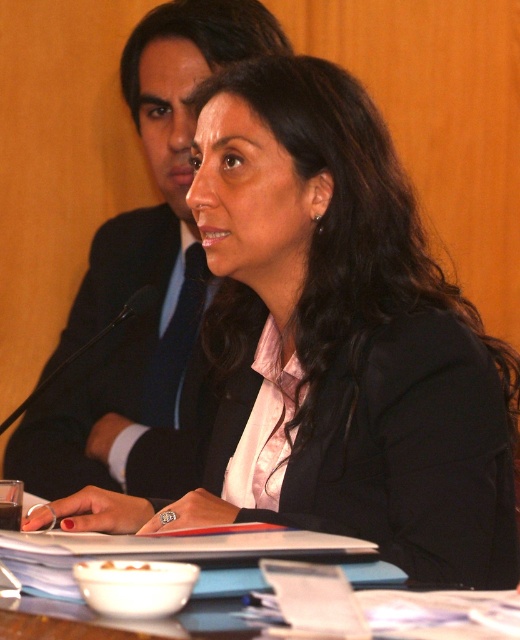
Question: Which object is farther from the camera taking this photo?

Choices:
 (A) black matte suit at upper center
 (B) wooden table at center

Answer: (A)

Question: Can you confirm if black matte suit at upper center is smaller than wooden table at center?

Choices:
 (A) no
 (B) yes

Answer: (A)

Question: Can you confirm if black matte suit at upper center is positioned to the left of wooden table at center?

Choices:
 (A) yes
 (B) no

Answer: (A)

Question: Observing the image, what is the correct spatial positioning of black matte suit at upper center in reference to wooden table at center?

Choices:
 (A) right
 (B) left

Answer: (B)